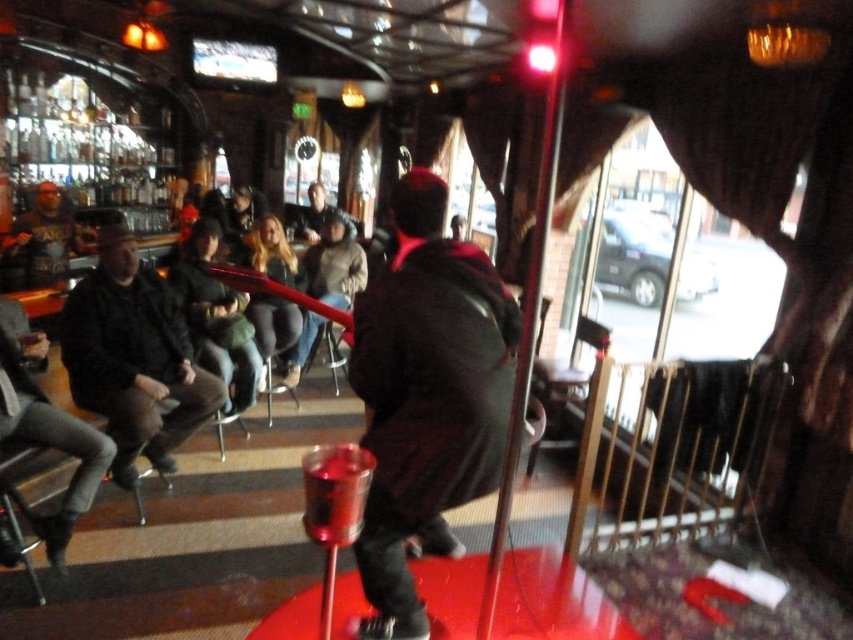
Can you confirm if dark brown leather jacket at center is positioned to the right of dark brown leather jacket at left?

Indeed, dark brown leather jacket at center is positioned on the right side of dark brown leather jacket at left.

Between dark brown leather jacket at center and dark brown leather jacket at left, which one appears on the right side from the viewer's perspective?

dark brown leather jacket at center

Which is behind, point (428, 288) or point (202, 372)?

The point (202, 372) is more distant.

Identify the location of dark brown leather jacket at center. This screenshot has width=853, height=640. (427, 396).

Is dark brown leather jacket at center above matte black jacket at left?

No.

Does dark brown leather jacket at center appear on the left side of matte black jacket at left?

In fact, dark brown leather jacket at center is to the right of matte black jacket at left.

Does point (456, 547) lie in front of point (35, 259)?

Yes, point (456, 547) is closer to viewer.

Identify the location of dark brown leather jacket at center. The image size is (853, 640). (427, 396).

Does dark brown leather jacket at left appear under matte black jacket at left?

Indeed, dark brown leather jacket at left is positioned under matte black jacket at left.

Between point (170, 378) and point (45, 282), which one is positioned behind?

The point (45, 282) is behind.

Find the location of a particular element. This screenshot has width=853, height=640. dark brown leather jacket at left is located at coordinates (132, 356).